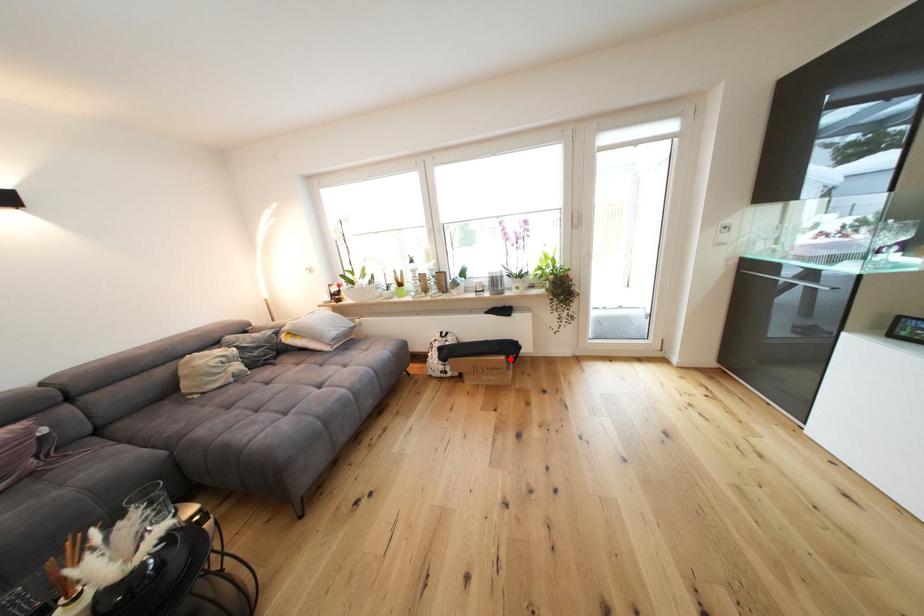
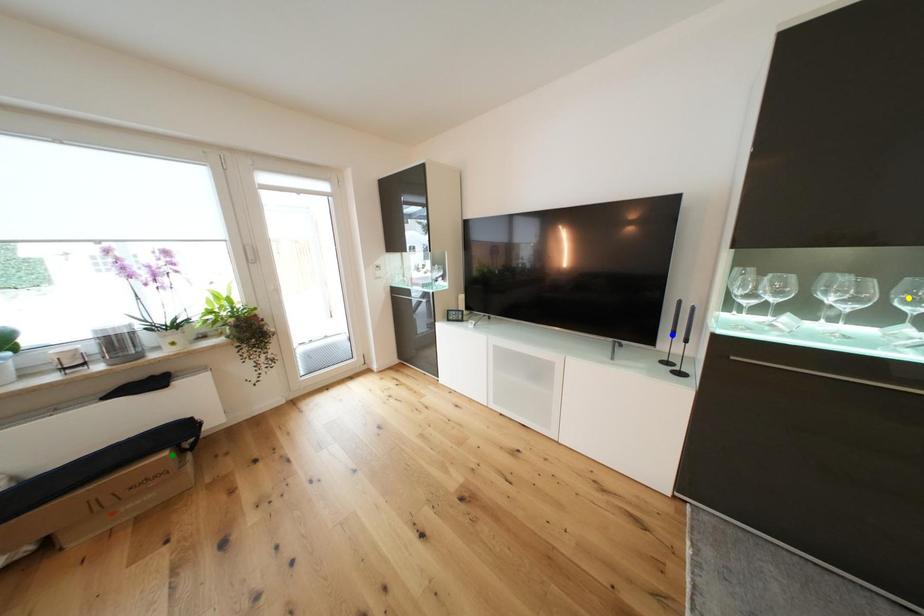
Question: I am providing you with two images of the same scene from different viewpoints. A red point is marked on the first image. You are given multiple points on the second image. Which mark in image 2 goes with the point in image 1?

Choices:
 (A) green point
 (B) yellow point
 (C) blue point

Answer: (A)